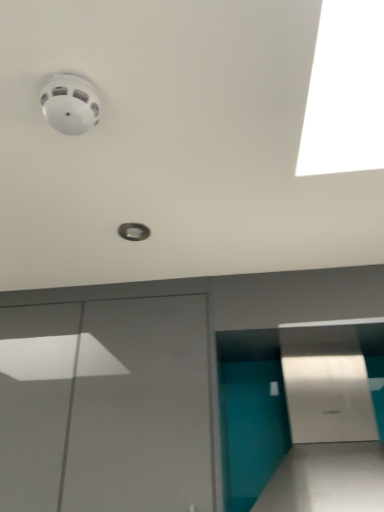
Locate an element on the screen. Image resolution: width=384 pixels, height=512 pixels. teal glossy wall at lower right is located at coordinates (300, 417).

Describe the element at coordinates (300, 417) in the screenshot. I see `teal glossy wall at lower right` at that location.

This screenshot has height=512, width=384. Find the location of `white glossy door at lower left`. white glossy door at lower left is located at coordinates (105, 406).

This screenshot has width=384, height=512. Describe the element at coordinates (105, 406) in the screenshot. I see `white glossy door at lower left` at that location.

At what (x,y) coordinates should I click in order to perform the action: click on teal glossy wall at lower right. Please return your answer as a coordinate pair (x, y). Image resolution: width=384 pixels, height=512 pixels. Looking at the image, I should click on (300, 417).

Considering the relative positions of teal glossy wall at lower right and white glossy door at lower left in the image provided, is teal glossy wall at lower right to the right of white glossy door at lower left from the viewer's perspective?

Yes, teal glossy wall at lower right is to the right of white glossy door at lower left.

Is teal glossy wall at lower right closer to the viewer compared to white glossy door at lower left?

That is True.

Does point (301, 381) lie in front of point (171, 317)?

No, (301, 381) is further to viewer.

From the image's perspective, is teal glossy wall at lower right above or below white glossy door at lower left?

teal glossy wall at lower right is above white glossy door at lower left.

From a real-world perspective, is teal glossy wall at lower right below white glossy door at lower left?

Correct, in the physical world, teal glossy wall at lower right is lower than white glossy door at lower left.

Between teal glossy wall at lower right and white glossy door at lower left, which one has larger width?

teal glossy wall at lower right is wider.

Looking at this image, in terms of height, does teal glossy wall at lower right look taller or shorter compared to white glossy door at lower left?

Clearly, teal glossy wall at lower right is shorter compared to white glossy door at lower left.

Between teal glossy wall at lower right and white glossy door at lower left, which one has smaller size?

teal glossy wall at lower right is smaller.

Do you think teal glossy wall at lower right is within white glossy door at lower left, or outside of it?

teal glossy wall at lower right is not inside white glossy door at lower left, it's outside.

Is there a large distance between teal glossy wall at lower right and white glossy door at lower left?

teal glossy wall at lower right is actually quite close to white glossy door at lower left.

Could you tell me if teal glossy wall at lower right is turned towards white glossy door at lower left?

No, teal glossy wall at lower right is not facing towards white glossy door at lower left.

The image size is (384, 512). I want to click on garage door that is behind the teal glossy wall at lower right, so pos(105,406).

Considering the relative positions of white glossy door at lower left and teal glossy wall at lower right in the image provided, is white glossy door at lower left to the right of teal glossy wall at lower right from the viewer's perspective?

Incorrect, white glossy door at lower left is not on the right side of teal glossy wall at lower right.

Which object is closer to the camera, white glossy door at lower left or teal glossy wall at lower right?

teal glossy wall at lower right.

Is point (37, 436) more distant than point (375, 455)?

Yes, it is behind point (375, 455).

From the picture: From the image's perspective, relative to teal glossy wall at lower right, is white glossy door at lower left above or below?

Based on their image positions, white glossy door at lower left is located beneath teal glossy wall at lower right.

From a real-world perspective, who is located lower, white glossy door at lower left or teal glossy wall at lower right?

From a 3D spatial view, teal glossy wall at lower right is below.

Between white glossy door at lower left and teal glossy wall at lower right, which one has smaller width?

white glossy door at lower left is thinner.

Considering the relative sizes of white glossy door at lower left and teal glossy wall at lower right in the image provided, is white glossy door at lower left shorter than teal glossy wall at lower right?

Incorrect, the height of white glossy door at lower left does not fall short of that of teal glossy wall at lower right.

Is white glossy door at lower left smaller than teal glossy wall at lower right?

Incorrect, white glossy door at lower left is not smaller in size than teal glossy wall at lower right.

Can teal glossy wall at lower right be found inside white glossy door at lower left?

No, teal glossy wall at lower right is not inside white glossy door at lower left.

Is white glossy door at lower left not near teal glossy wall at lower right?

No, white glossy door at lower left is in close proximity to teal glossy wall at lower right.

Does white glossy door at lower left turn towards teal glossy wall at lower right?

No, white glossy door at lower left is not oriented towards teal glossy wall at lower right.

What's the angular difference between white glossy door at lower left and teal glossy wall at lower right's facing directions?

0.219 degrees.

How distant is white glossy door at lower left from teal glossy wall at lower right?

white glossy door at lower left is 14.50 inches away from teal glossy wall at lower right.

This screenshot has width=384, height=512. What are the coordinates of `garage door behind the teal glossy wall at lower right` in the screenshot? It's located at (105, 406).

At what (x,y) coordinates should I click in order to perform the action: click on garage door that is below the teal glossy wall at lower right (from the image's perspective). Please return your answer as a coordinate pair (x, y). This screenshot has width=384, height=512. Looking at the image, I should click on (105, 406).

Where is `parking garage on the right side of white glossy door at lower left`? This screenshot has width=384, height=512. parking garage on the right side of white glossy door at lower left is located at coordinates (300, 417).